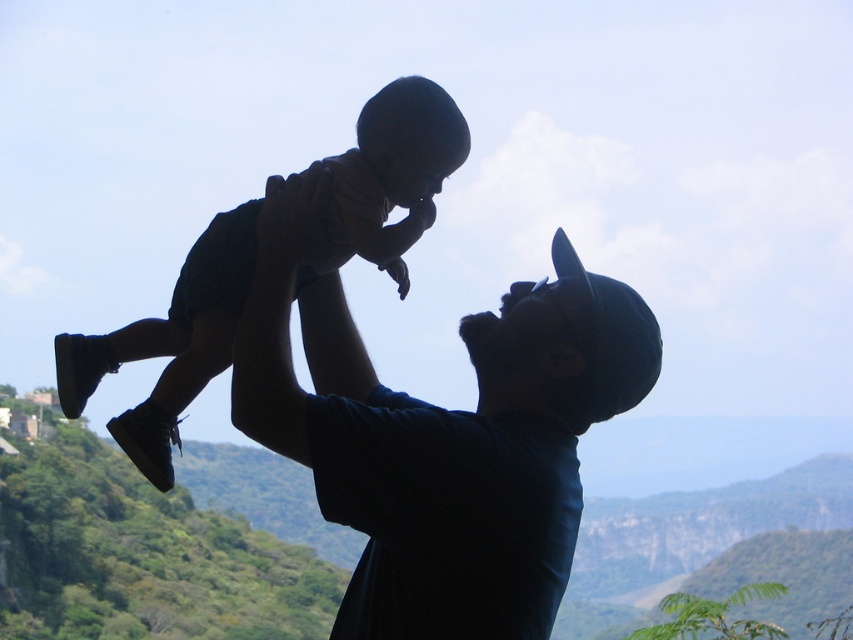
Question: Which point is farther from the camera taking this photo?

Choices:
 (A) (595, 390)
 (B) (242, 256)

Answer: (B)

Question: Is dark blue shirt at upper center smaller than silhouette baby at center?

Choices:
 (A) yes
 (B) no

Answer: (B)

Question: Is dark blue shirt at upper center smaller than silhouette baby at center?

Choices:
 (A) yes
 (B) no

Answer: (B)

Question: Which of the following is the closest to the observer?

Choices:
 (A) (96, 356)
 (B) (387, 550)

Answer: (B)

Question: Is dark blue shirt at upper center to the left of silhouette baby at center from the viewer's perspective?

Choices:
 (A) no
 (B) yes

Answer: (A)

Question: Which of the following is the closest to the observer?

Choices:
 (A) (560, 456)
 (B) (229, 330)

Answer: (A)